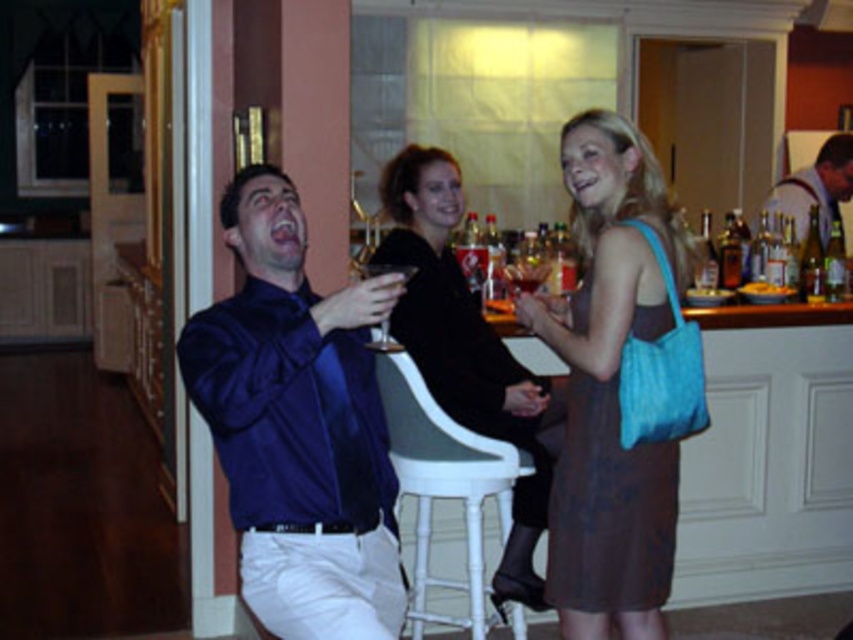
Question: Considering the relative positions of satin blue shirt at left and matte brown dress at center in the image provided, where is satin blue shirt at left located with respect to matte brown dress at center?

Choices:
 (A) above
 (B) below

Answer: (A)

Question: Based on their relative distances, which object is nearer to the silvery metallic tie at upper right?

Choices:
 (A) matte brown dress at center
 (B) transparent glass at center
 (C) white plastic stool at lower center
 (D) satin blue shirt at left

Answer: (A)

Question: Does matte brown dress at center appear on the left side of silvery metallic tie at upper right?

Choices:
 (A) no
 (B) yes

Answer: (B)

Question: Can you confirm if silvery metallic tie at upper right is positioned below transparent glass at center?

Choices:
 (A) no
 (B) yes

Answer: (A)

Question: Among these points, which one is farthest from the camera?

Choices:
 (A) (554, 451)
 (B) (627, 561)
 (C) (350, 429)
 (D) (846, 161)

Answer: (D)

Question: Among these objects, which one is nearest to the camera?

Choices:
 (A) white plastic stool at lower center
 (B) matte brown dress at center
 (C) black fabric dress at center
 (D) transparent glass at center

Answer: (D)